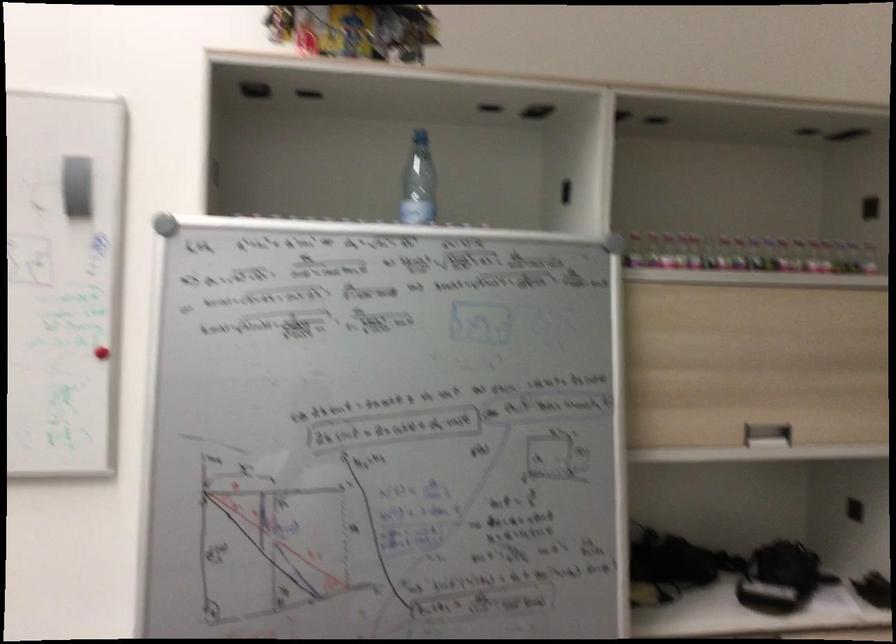
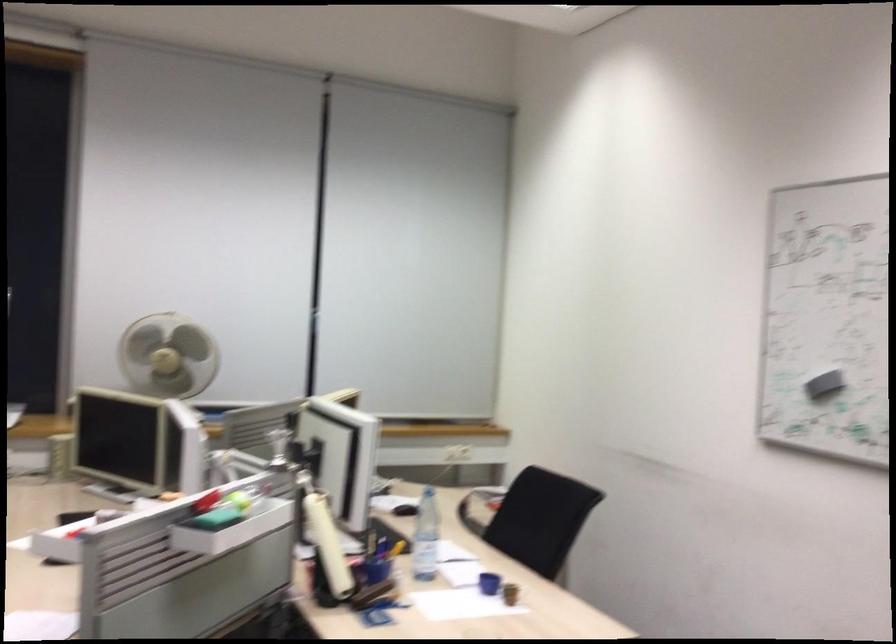
Question: The images are taken continuously from a first-person perspective. In which direction is your viewpoint rotating?

Choices:
 (A) Left
 (B) Right
 (C) Up
 (D) Down

Answer: (A)